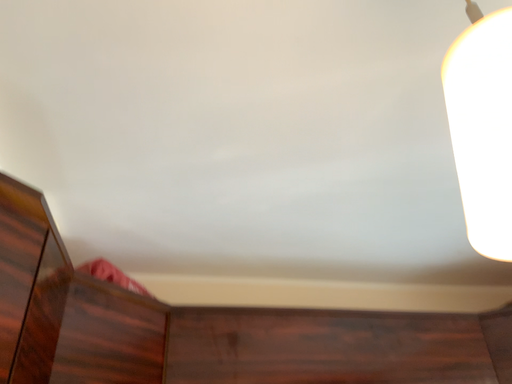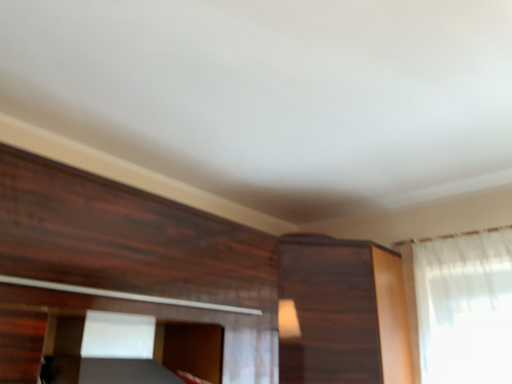
Question: Which way did the camera rotate in the video?

Choices:
 (A) rotated right
 (B) rotated left

Answer: (A)